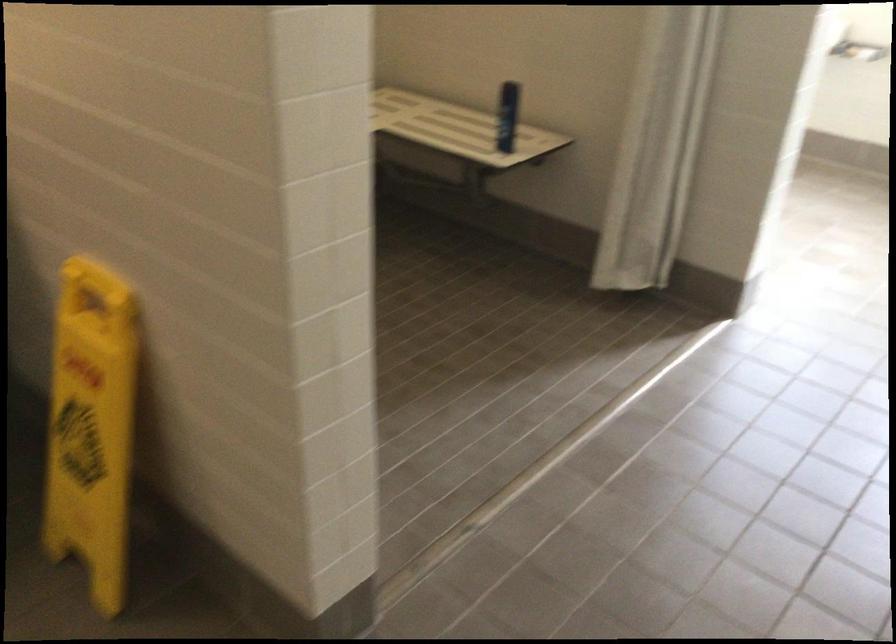
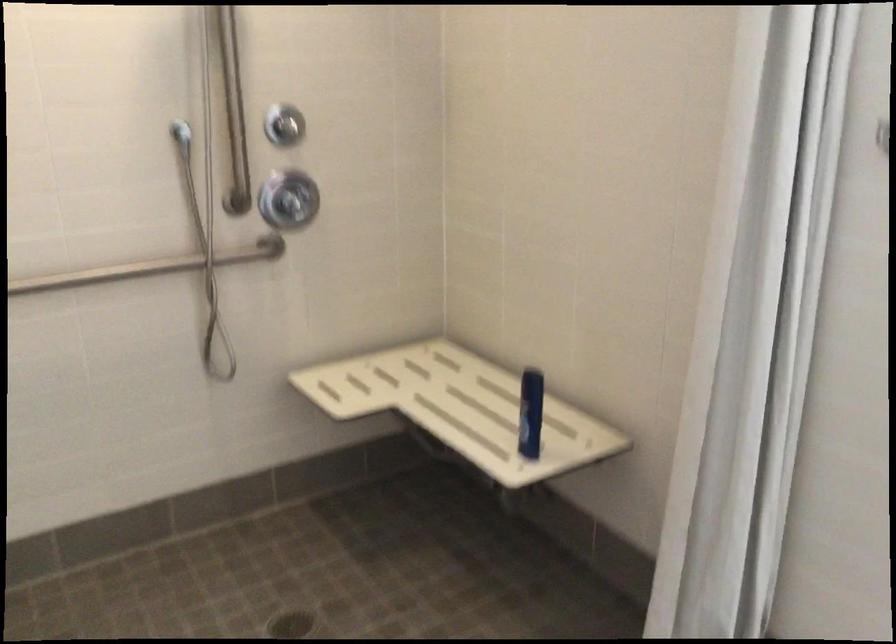
Locate, in the second image, the point that corresponds to the point at 507,116 in the first image.

(530, 413)